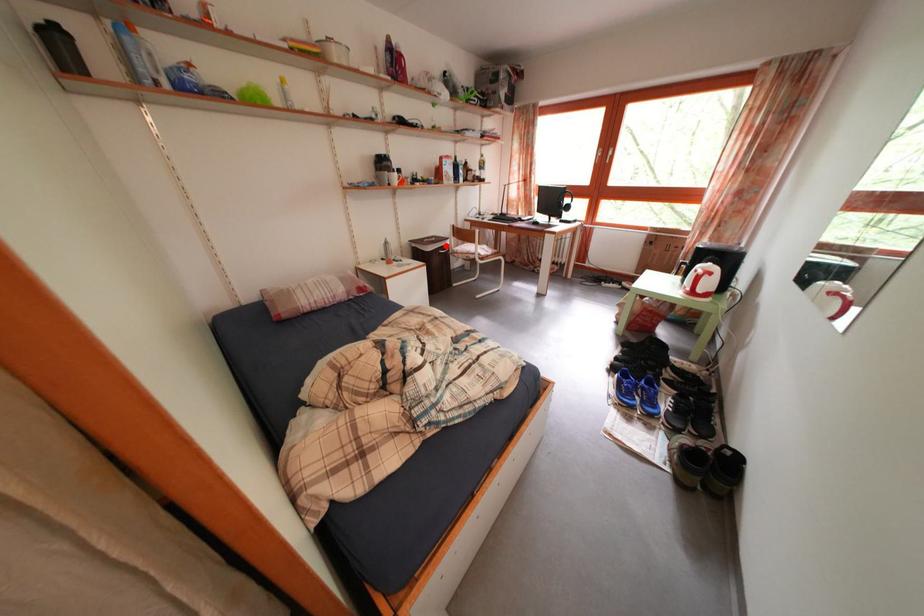
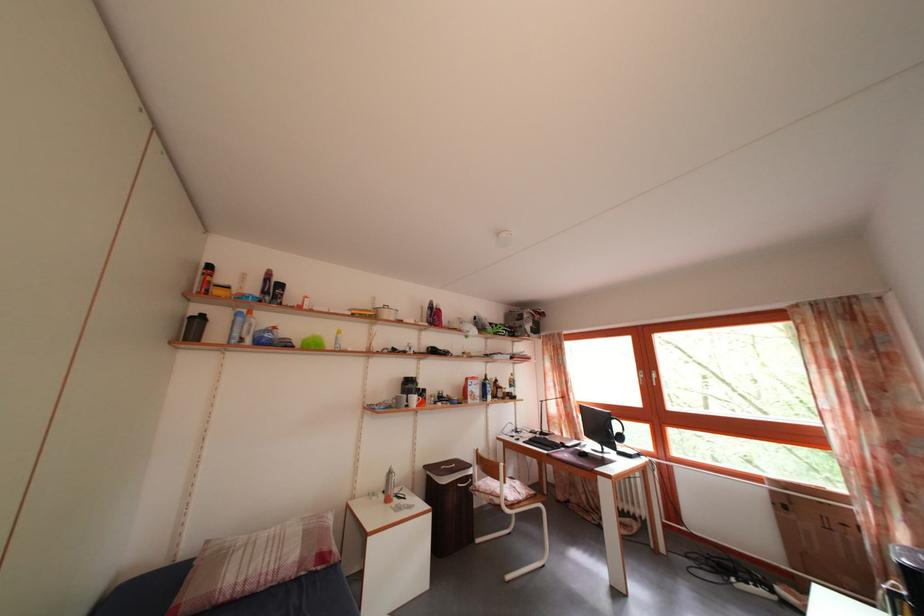
Where in the second image is the point corresponding to the highlighted location from the first image?

(468, 472)